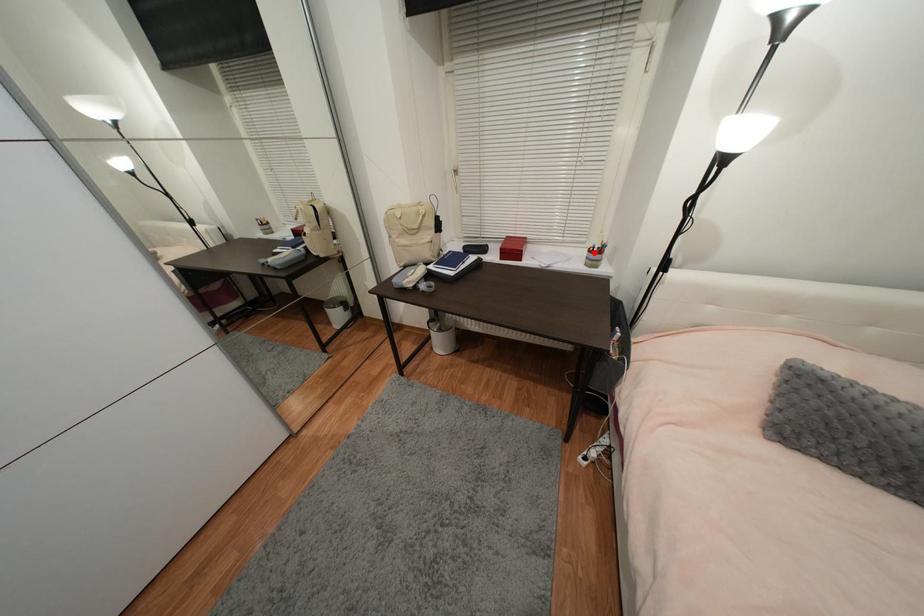
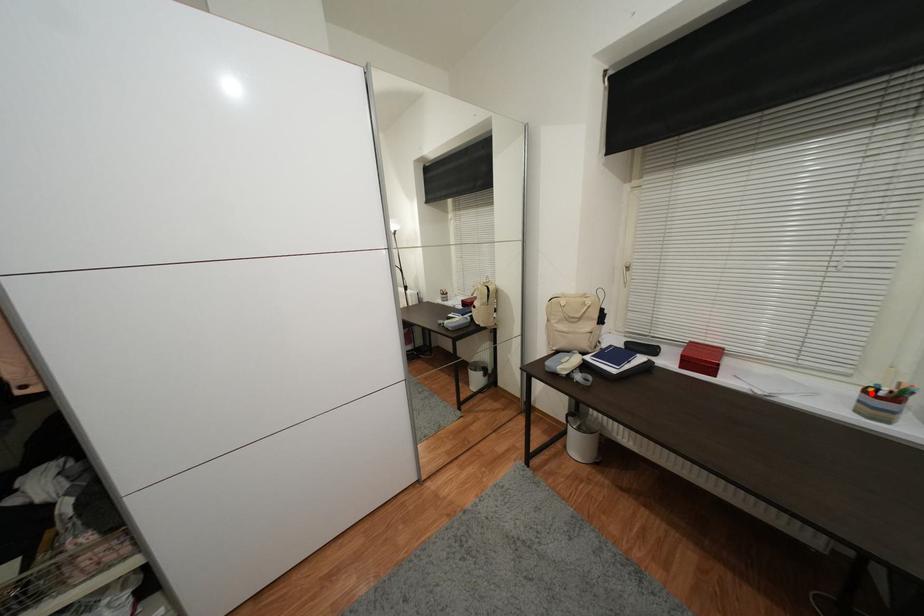
I am providing you with two images of the same scene from different viewpoints. A red point is marked on the first image and another point is marked on the second image. Is the red point in image1 aligned with the point shown in image2?

Yes